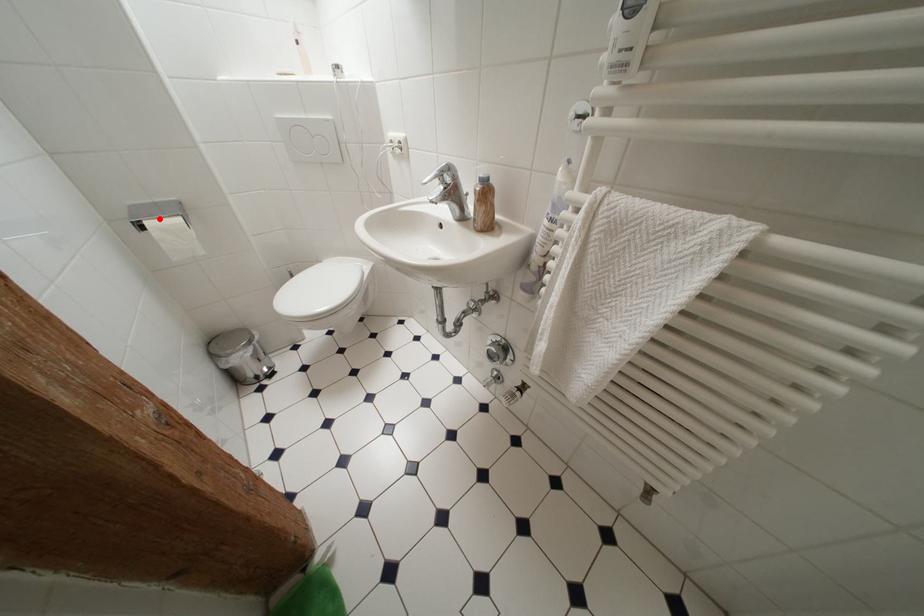
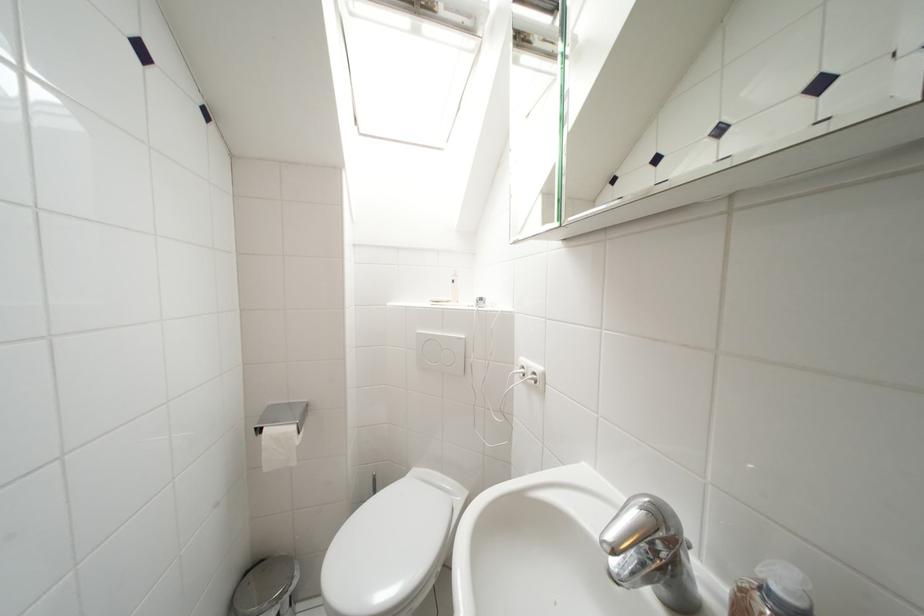
Locate, in the second image, the point that corresponds to the highlighted location in the first image.

(283, 424)